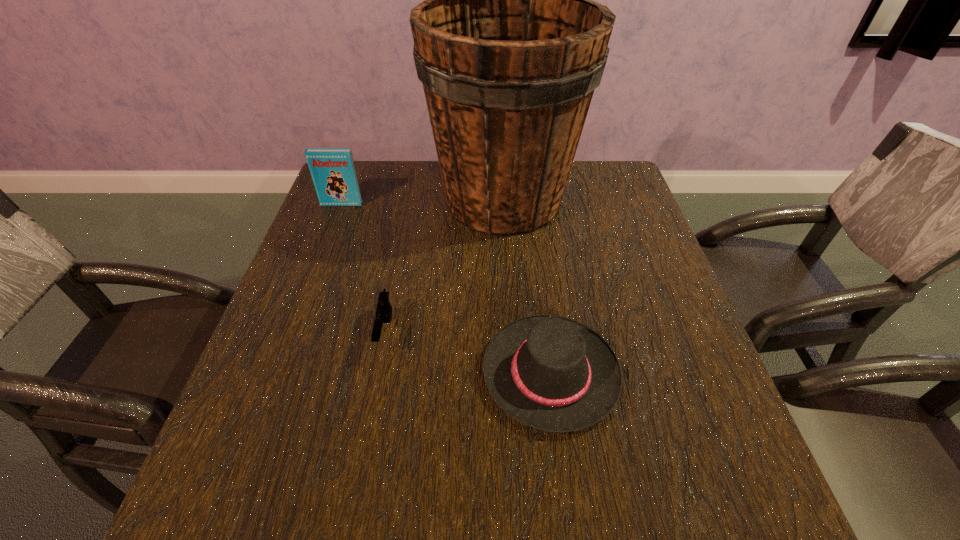
Where is `the tallest object`? The height and width of the screenshot is (540, 960). the tallest object is located at coordinates (509, 45).

Where is `book`? book is located at coordinates (333, 172).

What are the coordinates of `the leftmost object` in the screenshot? It's located at (333, 172).

At what (x,y) coordinates should I click in order to perform the action: click on the second shortest object. Please return your answer as a coordinate pair (x, y). The image size is (960, 540). Looking at the image, I should click on (552, 373).

Identify the location of pistol. The height and width of the screenshot is (540, 960). (384, 309).

Locate an element on the screen. The height and width of the screenshot is (540, 960). the shortest object is located at coordinates (384, 309).

The image size is (960, 540). Find the location of `free spot located on the front of the tallest object`. free spot located on the front of the tallest object is located at coordinates (512, 327).

In order to click on free space located on the front cover of the book in this screenshot , I will do `click(333, 226)`.

Locate an element on the screen. This screenshot has width=960, height=540. free region located on the left of the dress hat is located at coordinates (372, 373).

Identify the location of free space located on the front-facing side of the second object from left to right. The height and width of the screenshot is (540, 960). (367, 428).